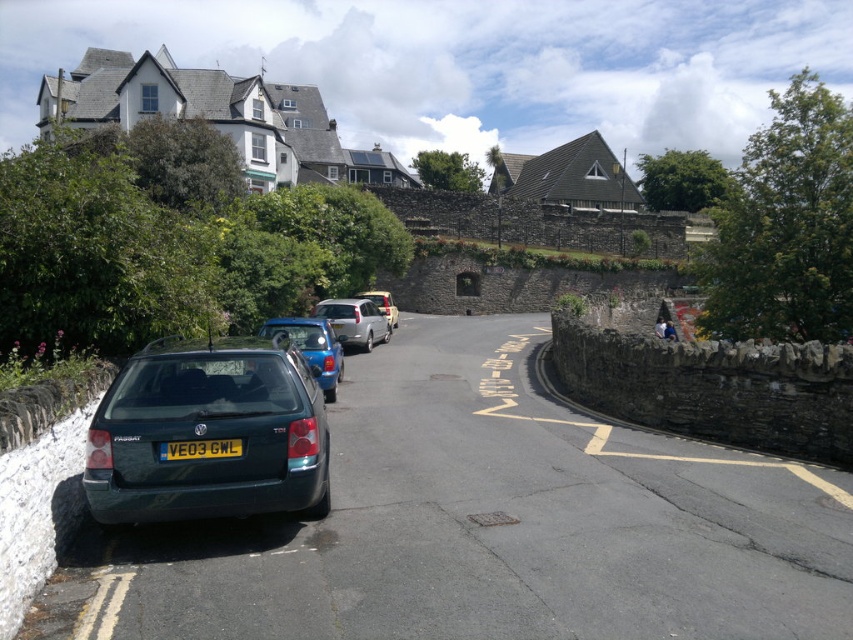
Question: Is blue metallic hatchback at center wider than silver metallic van at center?

Choices:
 (A) yes
 (B) no

Answer: (B)

Question: Estimate the real-world distances between objects in this image. Which object is closer to the blue metallic hatchback at center?

Choices:
 (A) silver metallic van at center
 (B) metallic green estate car at lower left
 (C) satin silver van at center

Answer: (B)

Question: Does metallic green estate car at lower left have a greater width compared to silver metallic van at center?

Choices:
 (A) no
 (B) yes

Answer: (A)

Question: Which point is closer to the camera taking this photo?

Choices:
 (A) coord(178,481)
 (B) coord(358,292)
 (C) coord(161,451)
 (D) coord(341,340)

Answer: (C)

Question: Estimate the real-world distances between objects in this image. Which object is closer to the yellow matte license plate at center?

Choices:
 (A) satin silver van at center
 (B) blue metallic hatchback at center
 (C) silver metallic van at center

Answer: (B)

Question: Can you confirm if metallic green estate car at lower left is wider than silver metallic van at center?

Choices:
 (A) yes
 (B) no

Answer: (B)